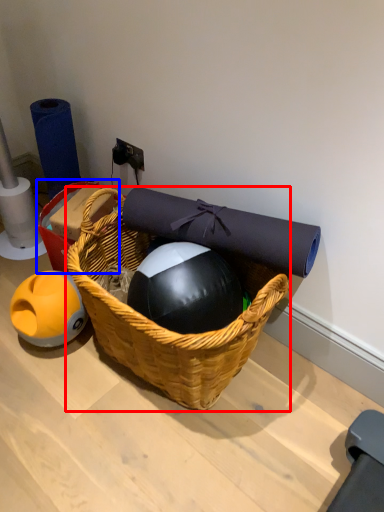
Question: Among these objects, which one is farthest to the camera, picnic basket (highlighted by a red box) or basket (highlighted by a blue box)?

Choices:
 (A) picnic basket
 (B) basket

Answer: (B)